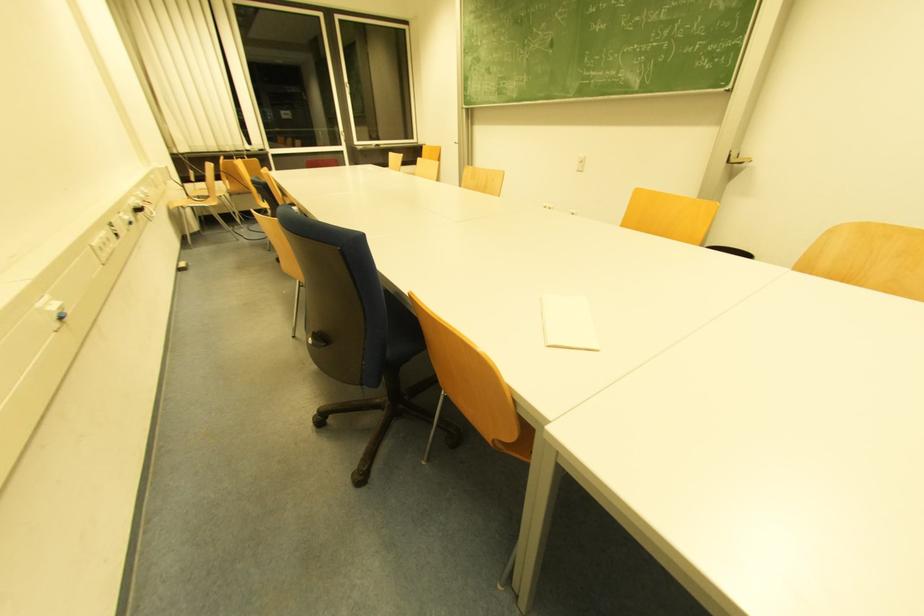
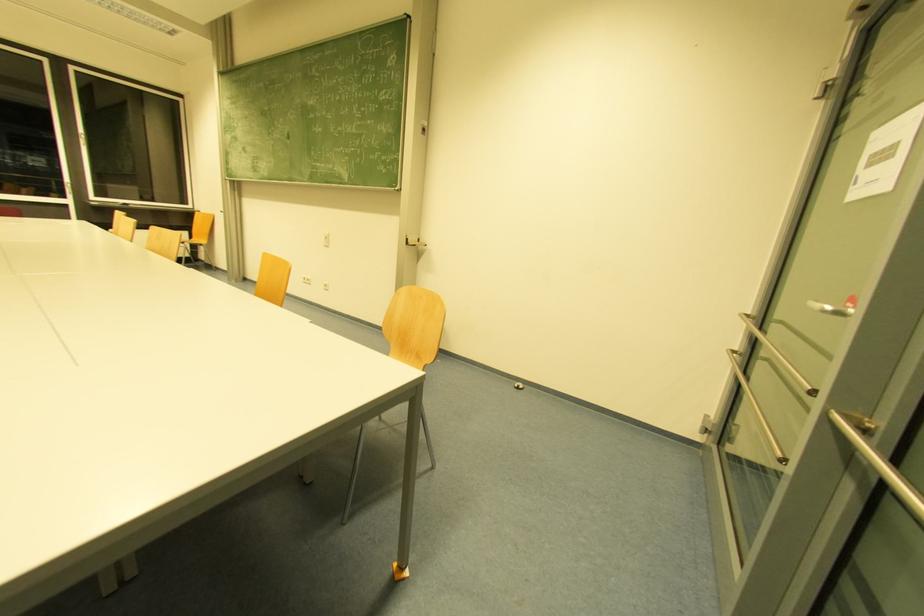
Question: What movement of the cameraman would produce the second image?

Choices:
 (A) Left
 (B) Right
 (C) Forward
 (D) Backward

Answer: (B)